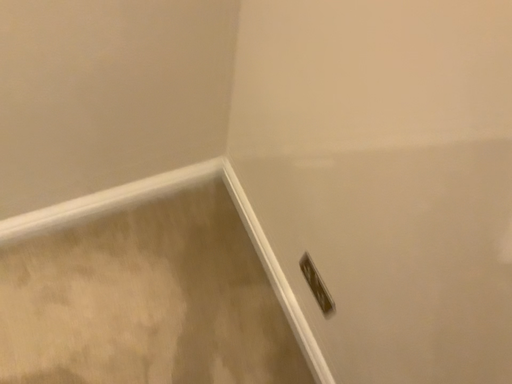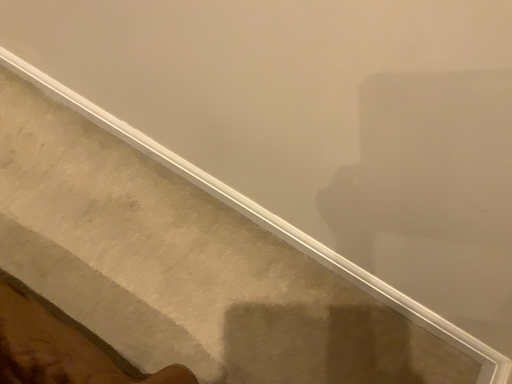
Question: Which way did the camera rotate in the video?

Choices:
 (A) rotated right
 (B) rotated left

Answer: (B)